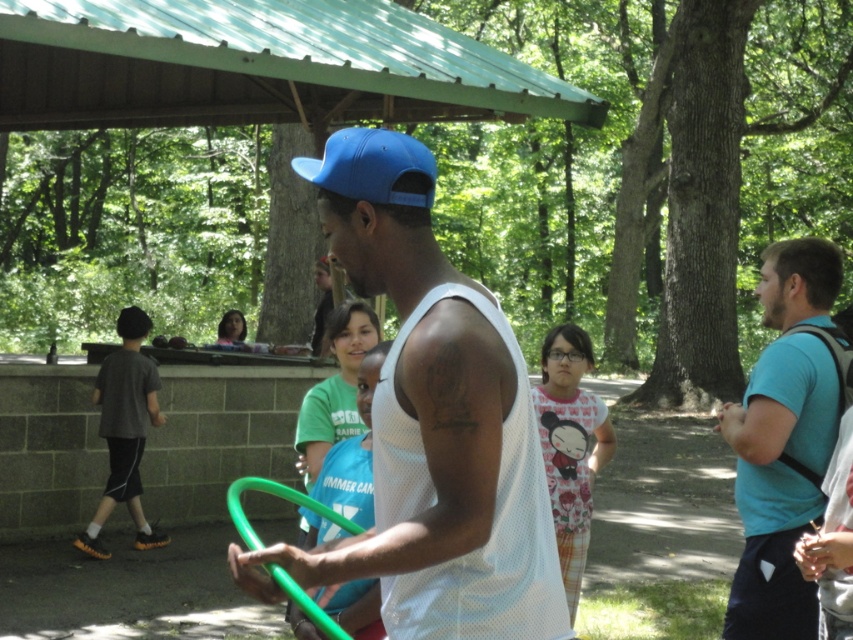
Who is positioned more to the right, white mesh tank top at center or blue mesh shirt at right?

blue mesh shirt at right is more to the right.

Describe the element at coordinates (431, 422) in the screenshot. The width and height of the screenshot is (853, 640). I see `white mesh tank top at center` at that location.

Locate an element on the screen. white mesh tank top at center is located at coordinates (431, 422).